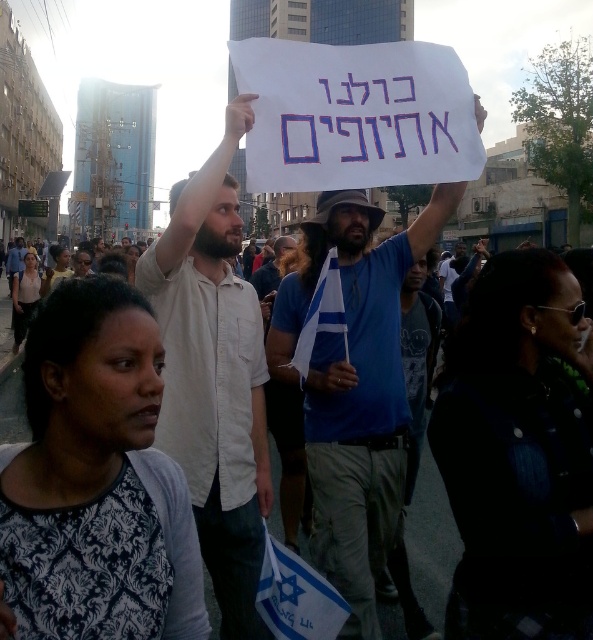
Is white shirt at upper center shorter than blue cotton shirt at center?

No, white shirt at upper center is not shorter than blue cotton shirt at center.

Does white shirt at upper center appear on the left side of blue cotton shirt at center?

Indeed, white shirt at upper center is positioned on the left side of blue cotton shirt at center.

Where is `white shirt at upper center`? The width and height of the screenshot is (593, 640). white shirt at upper center is located at coordinates (215, 376).

This screenshot has width=593, height=640. I want to click on white shirt at upper center, so click(215, 376).